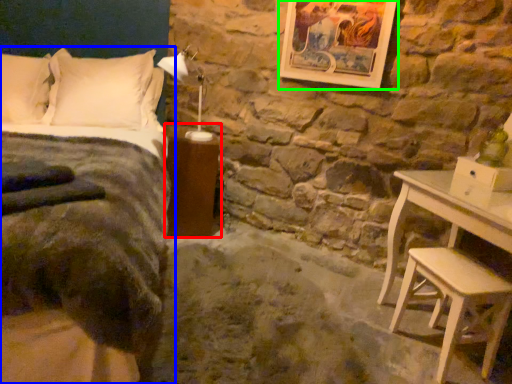
Question: Based on their relative distances, which object is nearer to nightstand (highlighted by a red box)? Choose from bed (highlighted by a blue box) and picture frame (highlighted by a green box).

Choices:
 (A) bed
 (B) picture frame

Answer: (A)